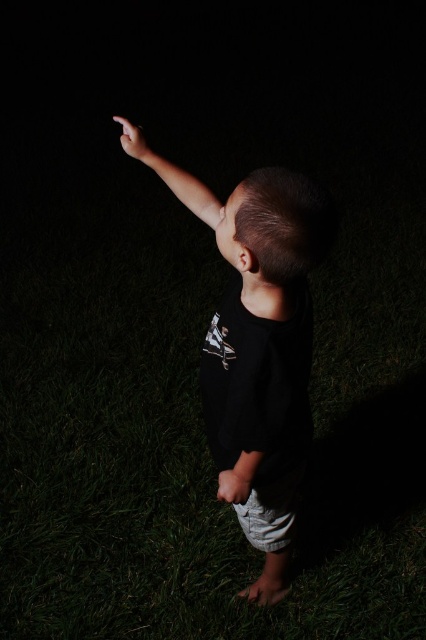
Question: Is black matte shirt at upper center behind matte black arm at upper left?

Choices:
 (A) yes
 (B) no

Answer: (B)

Question: Is black matte shirt at upper center further to the viewer compared to black matte shirt at center?

Choices:
 (A) yes
 (B) no

Answer: (B)

Question: Which object is positioned farthest from the black matte shirt at upper center?

Choices:
 (A) matte black finger at upper right
 (B) white matte hand at lower center
 (C) black matte shirt at center

Answer: (A)

Question: Which of the following is the closest to the observer?

Choices:
 (A) (132, 141)
 (B) (241, 481)
 (C) (127, 129)

Answer: (B)

Question: Can you confirm if black matte shirt at center is thinner than white matte hand at lower center?

Choices:
 (A) yes
 (B) no

Answer: (B)

Question: Which point is closer to the camera taking this photo?

Choices:
 (A) (244, 486)
 (B) (290, 284)
 (C) (134, 147)

Answer: (B)